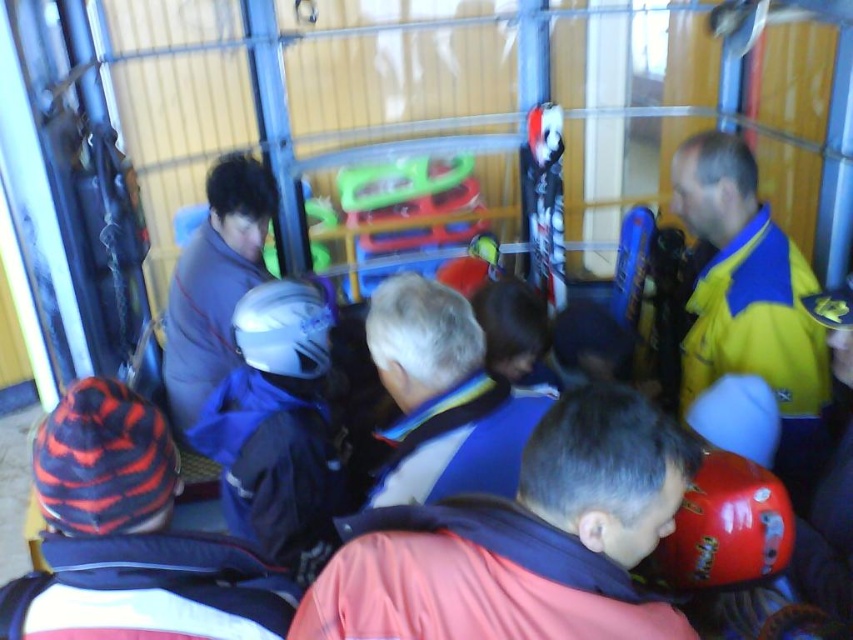
Which of these two, yellow/blue jacket at right or striped knit hat at lower left, stands taller?

yellow/blue jacket at right

Is point (787, 476) behind point (86, 474)?

Yes, point (787, 476) is behind point (86, 474).

Identify the location of yellow/blue jacket at right. This screenshot has width=853, height=640. (750, 301).

Can you confirm if gray fabric jacket at center is positioned to the left of shiny red helmet at lower right?

Correct, you'll find gray fabric jacket at center to the left of shiny red helmet at lower right.

Is gray fabric jacket at center thinner than shiny red helmet at lower right?

No, gray fabric jacket at center is not thinner than shiny red helmet at lower right.

Which is behind, point (181, 316) or point (791, 552)?

Positioned behind is point (181, 316).

Locate an element on the screen. gray fabric jacket at center is located at coordinates (213, 282).

What do you see at coordinates (750, 301) in the screenshot? I see `yellow/blue jacket at right` at bounding box center [750, 301].

Who is more forward, (717, 148) or (201, 230)?

Point (717, 148) is in front.

Where is `yellow/blue jacket at right`? This screenshot has height=640, width=853. yellow/blue jacket at right is located at coordinates (750, 301).